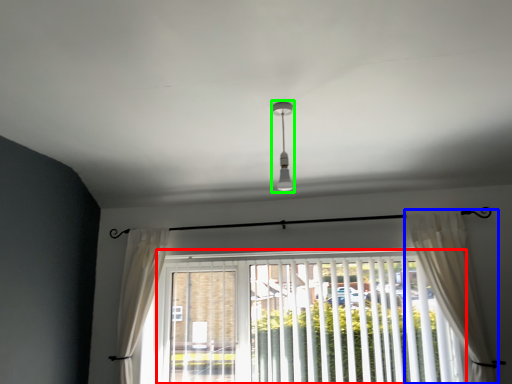
Question: Which is farther away from window blind (highlighted by a red box)? curtain (highlighted by a blue box) or light fixture (highlighted by a green box)?

Choices:
 (A) curtain
 (B) light fixture

Answer: (B)